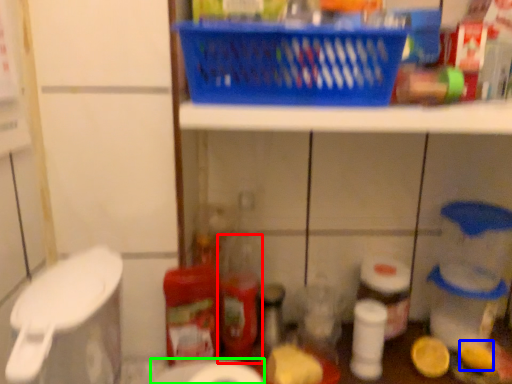
Question: Estimate the real-world distances between objects in this image. Which object is farther from bottle (highlighted by a red box), toilet paper (highlighted by a blue box) or toilet paper (highlighted by a green box)?

Choices:
 (A) toilet paper
 (B) toilet paper

Answer: (A)